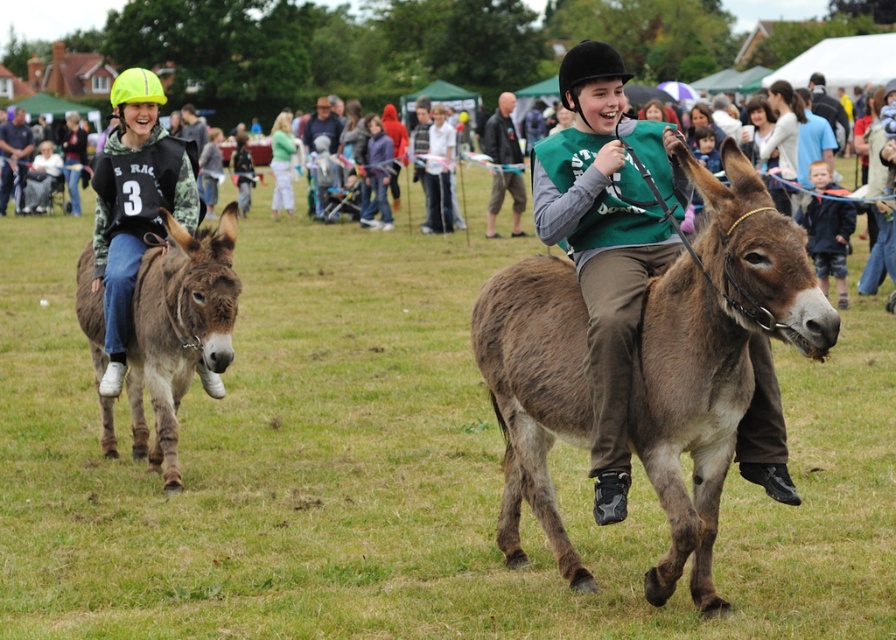
Does brown fuzzy mule at center have a lesser height compared to brown fuzzy mule at left?

In fact, brown fuzzy mule at center may be taller than brown fuzzy mule at left.

Which is behind, point (616, 280) or point (177, 374)?

The point (177, 374) is behind.

Between point (537, 308) and point (224, 310), which one is positioned behind?

The point (224, 310) is behind.

Identify the location of brown fuzzy mule at center. This screenshot has height=640, width=896. (714, 355).

Is brown fuzzy mule at left below neon yellow helmet at left?

Yes, brown fuzzy mule at left is below neon yellow helmet at left.

Is point (145, 288) farther from camera compared to point (145, 88)?

That is False.

Identify the location of brown fuzzy mule at left. (178, 330).

Who is more forward, (677, 300) or (142, 168)?

Positioned in front is point (677, 300).

Which of these two, brown fuzzy mule at center or neon yellow helmet at left, stands shorter?

neon yellow helmet at left is shorter.

Image resolution: width=896 pixels, height=640 pixels. In order to click on brown fuzzy mule at center in this screenshot , I will do `click(714, 355)`.